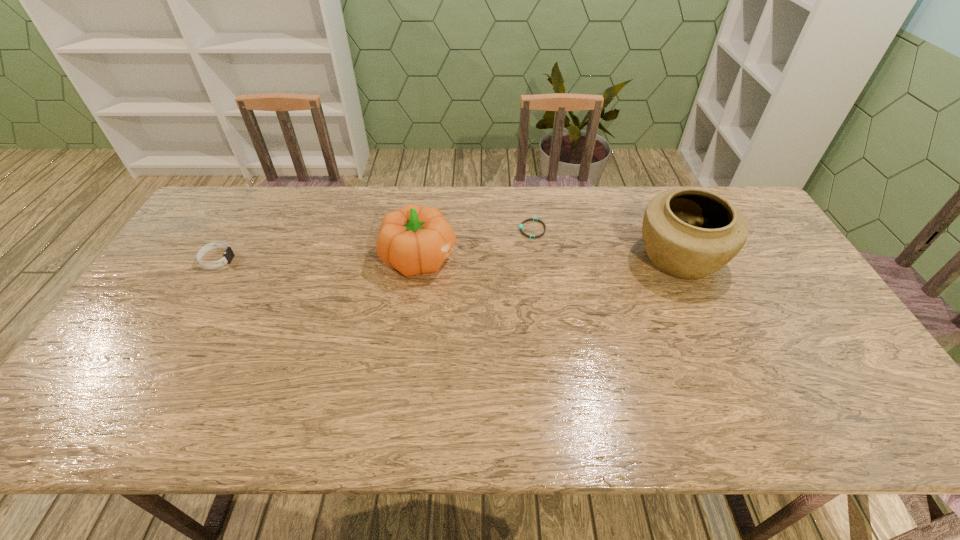
This screenshot has width=960, height=540. In order to click on the rightmost object in this screenshot , I will do `click(688, 233)`.

This screenshot has width=960, height=540. I want to click on pumpkin, so click(414, 240).

Locate an element on the screen. The width and height of the screenshot is (960, 540). the nearer wristband is located at coordinates (228, 255).

The image size is (960, 540). What are the coordinates of `the left wristband` in the screenshot? It's located at (228, 255).

You are a GUI agent. You are given a task and a screenshot of the screen. Output one action in this format:
    pyautogui.click(x=<x>, y=<y>)
    Task: Click on the shorter wristband
    The width and height of the screenshot is (960, 540).
    Given the screenshot: What is the action you would take?
    pyautogui.click(x=530, y=219)

You are a GUI agent. You are given a task and a screenshot of the screen. Output one action in this format:
    pyautogui.click(x=<x>, y=<y>)
    Task: Click on the right wristband
    
    Given the screenshot: What is the action you would take?
    pyautogui.click(x=530, y=219)

Find the location of `vacant space situated on the left of the pottery`. vacant space situated on the left of the pottery is located at coordinates (601, 258).

Identify the location of vacant space located 0.210m on the carved face of the second object from left to right. This screenshot has height=540, width=960. (527, 258).

The width and height of the screenshot is (960, 540). What are the coordinates of `vacant space located 0.330m on the outer surface of the taller wristband` in the screenshot? It's located at (343, 259).

Where is `free space located 0.050m on the buckle of the shortest object`? This screenshot has height=540, width=960. free space located 0.050m on the buckle of the shortest object is located at coordinates (503, 230).